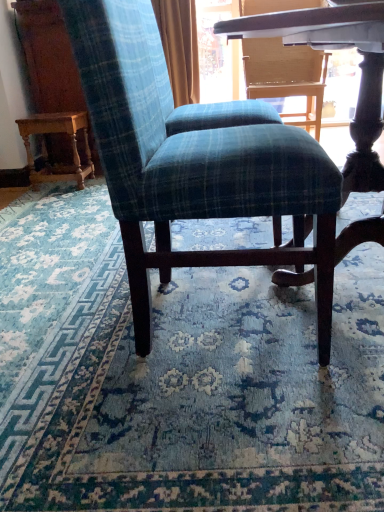
Locate an element on the screen. This screenshot has width=384, height=512. plaid fabric chair at center is located at coordinates (194, 168).

The image size is (384, 512). Find the location of `wooden carved table at left`. wooden carved table at left is located at coordinates coord(46,149).

Measure the distance between point (53, 502) and camera.

The depth of point (53, 502) is 29.02 inches.

You are a GUI agent. You are given a task and a screenshot of the screen. Output one action in this format:
    pyautogui.click(x=<x>, y=<y>)
    Task: Click on the blue plaid fabric at center
    The height and width of the screenshot is (512, 384).
    Given the screenshot: What is the action you would take?
    pyautogui.click(x=179, y=377)

Find the location of a particular element. The width and height of the screenshot is (384, 512). plaid fabric chair at center is located at coordinates (194, 168).

Is plaid fabric chair at center facing away from wooden carved table at left?

No, wooden carved table at left is not at the back of plaid fabric chair at center.

From the image's perspective, which one is positioned higher, plaid fabric chair at center or wooden carved table at left?

wooden carved table at left, from the image's perspective.

Which point is more distant from viewer, (196, 196) or (60, 170)?

Positioned behind is point (60, 170).

Who is taller, plaid fabric chair at center or blue plaid fabric at center?

Standing taller between the two is plaid fabric chair at center.

From a real-world perspective, who is located lower, plaid fabric chair at center or blue plaid fabric at center?

From a 3D spatial view, blue plaid fabric at center is below.

Is point (123, 7) positioned before point (109, 326)?

Yes, point (123, 7) is in front of point (109, 326).

Based on their sizes in the image, would you say plaid fabric chair at center is bigger or smaller than blue plaid fabric at center?

Considering their sizes, plaid fabric chair at center takes up more space than blue plaid fabric at center.

I want to click on chair that is above the blue plaid fabric at center (from the image's perspective), so click(x=194, y=168).

How far apart are blue plaid fabric at center and plaid fabric chair at center?

blue plaid fabric at center and plaid fabric chair at center are 13.31 inches apart.

From the image's perspective, relative to plaid fabric chair at center, is blue plaid fabric at center above or below?

Clearly, from the image's perspective, blue plaid fabric at center is below plaid fabric chair at center.

In the scene shown: From a real-world perspective, which is physically above, blue plaid fabric at center or plaid fabric chair at center?

plaid fabric chair at center, from a real-world perspective.

From the picture: Can you confirm if wooden carved table at left is wider than blue plaid fabric at center?

In fact, wooden carved table at left might be narrower than blue plaid fabric at center.

Considering the relative sizes of wooden carved table at left and blue plaid fabric at center in the image provided, is wooden carved table at left smaller than blue plaid fabric at center?

Yes.

From a real-world perspective, which is physically below, wooden carved table at left or blue plaid fabric at center?

blue plaid fabric at center is physically lower.

Does wooden carved table at left come behind blue plaid fabric at center?

Yes, the depth of wooden carved table at left is greater than that of blue plaid fabric at center.

Between point (45, 181) and point (230, 147), which one is positioned behind?

The point (45, 181) is farther from the camera.

Considering the sizes of objects wooden carved table at left and plaid fabric chair at center in the image provided, who is smaller, wooden carved table at left or plaid fabric chair at center?

With smaller size is wooden carved table at left.

Does wooden carved table at left turn towards plaid fabric chair at center?

No, wooden carved table at left does not turn towards plaid fabric chair at center.

Is blue plaid fabric at center surrounding wooden carved table at left?

Definitely not — wooden carved table at left is not inside blue plaid fabric at center.

Is the position of blue plaid fabric at center less distant than that of wooden carved table at left?

That is True.

From a real-world perspective, does blue plaid fabric at center stand above wooden carved table at left?

Actually, blue plaid fabric at center is physically below wooden carved table at left in the real world.

Is blue plaid fabric at center far from wooden carved table at left?

Yes, blue plaid fabric at center and wooden carved table at left are quite far apart.

Image resolution: width=384 pixels, height=512 pixels. What are the coordinates of `table below the plaid fabric chair at center (from a real-world perspective)` in the screenshot? It's located at (46, 149).

I want to click on chair that appears above the blue plaid fabric at center (from a real-world perspective), so click(x=194, y=168).

Considering their positions, is blue plaid fabric at center positioned closer to wooden carved table at left than plaid fabric chair at center?

Based on the image, blue plaid fabric at center appears to be nearer to wooden carved table at left.

Based on their spatial positions, is wooden carved table at left or blue plaid fabric at center closer to plaid fabric chair at center?

blue plaid fabric at center.

When comparing their distances from plaid fabric chair at center, does blue plaid fabric at center or wooden carved table at left seem closer?

blue plaid fabric at center is closer to plaid fabric chair at center.

Looking at the image, which one is located further to blue plaid fabric at center, plaid fabric chair at center or wooden carved table at left?

wooden carved table at left is further to blue plaid fabric at center.

Looking at the image, which one is located closer to wooden carved table at left, plaid fabric chair at center or blue plaid fabric at center?

Among the two, blue plaid fabric at center is located nearer to wooden carved table at left.

Based on their spatial positions, is wooden carved table at left or plaid fabric chair at center closer to blue plaid fabric at center?

plaid fabric chair at center lies closer to blue plaid fabric at center than the other object.

Where is `mat located between plaid fabric chair at center and wooden carved table at left in the depth direction`? This screenshot has width=384, height=512. mat located between plaid fabric chair at center and wooden carved table at left in the depth direction is located at coordinates (179, 377).